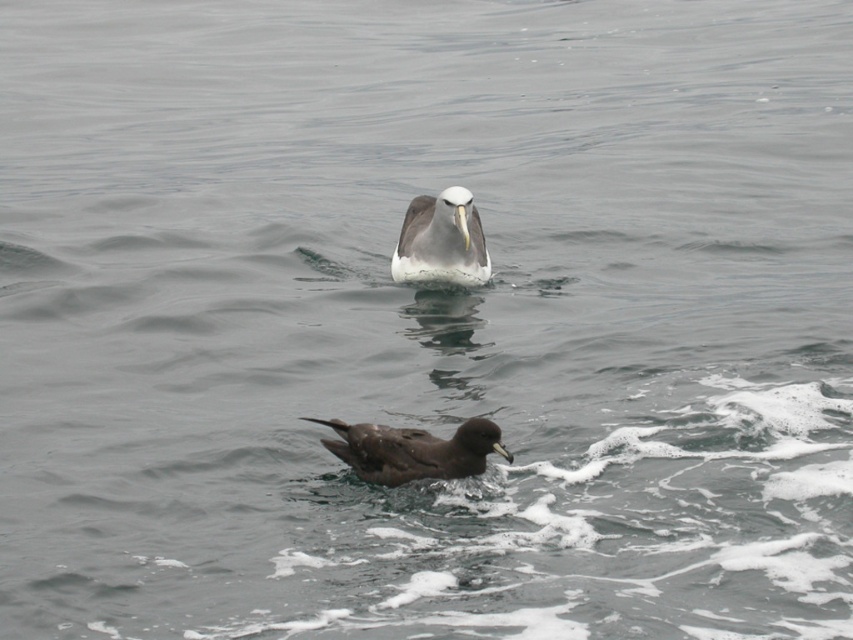
From the picture: Is dark brown feathers at lower center thinner than white glossy bird at center?

In fact, dark brown feathers at lower center might be wider than white glossy bird at center.

Is the position of dark brown feathers at lower center less distant than that of white glossy bird at center?

Yes, it is in front of white glossy bird at center.

Between point (486, 433) and point (444, 232), which one is positioned in front?

Positioned in front is point (486, 433).

Locate an element on the screen. Image resolution: width=853 pixels, height=640 pixels. dark brown feathers at lower center is located at coordinates (413, 451).